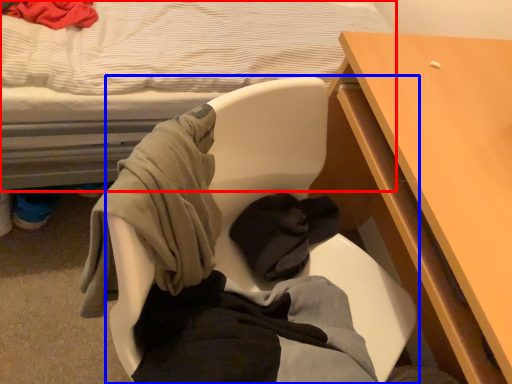
Question: Which point is further to the camera, bed (highlighted by a red box) or chair (highlighted by a blue box)?

Choices:
 (A) bed
 (B) chair

Answer: (B)